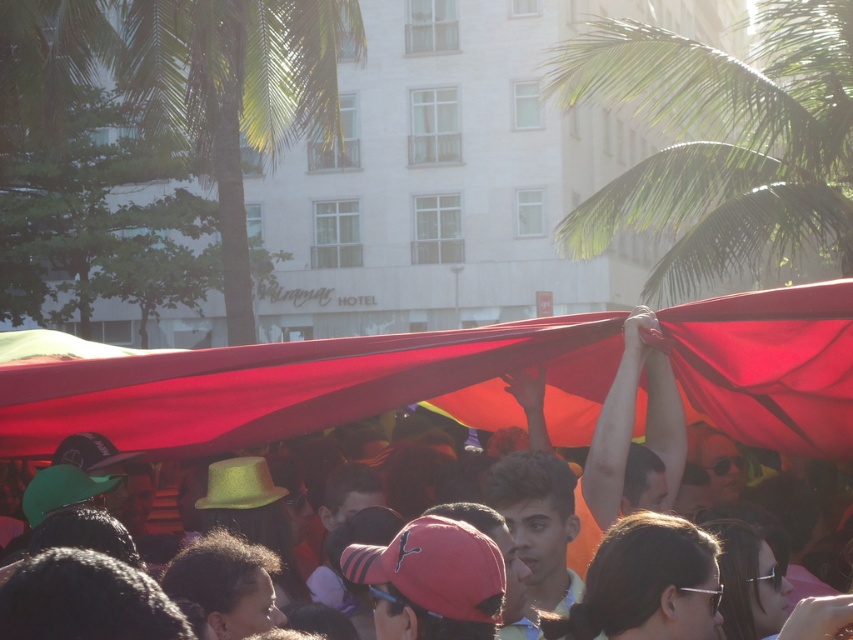
Question: Considering the relative positions of matte red fabric at center and green leafy palm tree at upper center in the image provided, where is matte red fabric at center located with respect to green leafy palm tree at upper center?

Choices:
 (A) right
 (B) left

Answer: (A)

Question: Among these points, which one is farthest from the camera?

Choices:
 (A) (225, 332)
 (B) (135, 360)

Answer: (A)

Question: From the image, what is the correct spatial relationship of matte red fabric at center in relation to green leafy palm tree at upper right?

Choices:
 (A) right
 (B) left

Answer: (B)

Question: Is matte red fabric at center below green leafy palm tree at upper right?

Choices:
 (A) no
 (B) yes

Answer: (B)

Question: Which point is farther to the camera?

Choices:
 (A) green leafy palm tree at upper right
 (B) green leafy palm tree at upper center
 (C) matte red fabric at center

Answer: (B)

Question: Estimate the real-world distances between objects in this image. Which object is closer to the matte red fabric at center?

Choices:
 (A) green leafy palm tree at upper right
 (B) green leafy palm tree at upper center

Answer: (A)